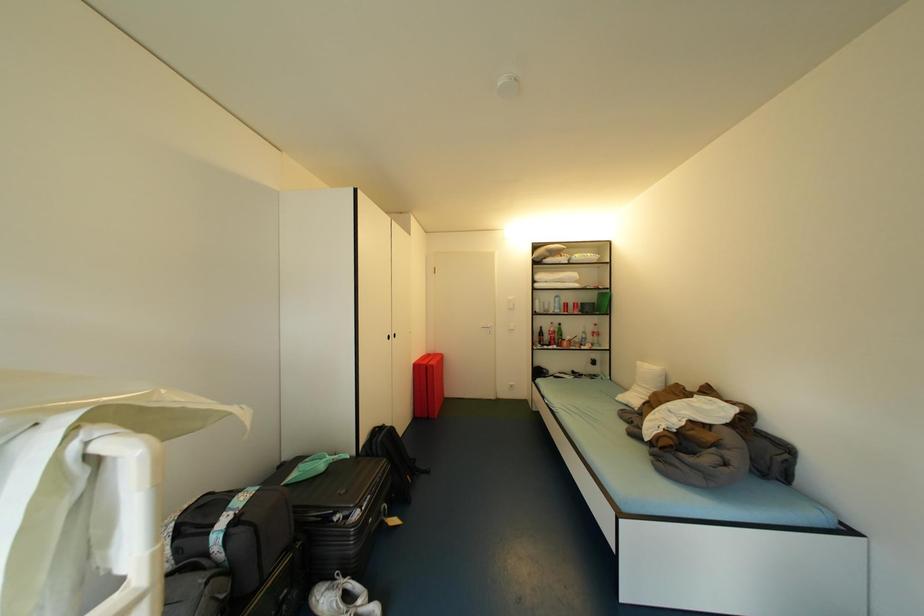
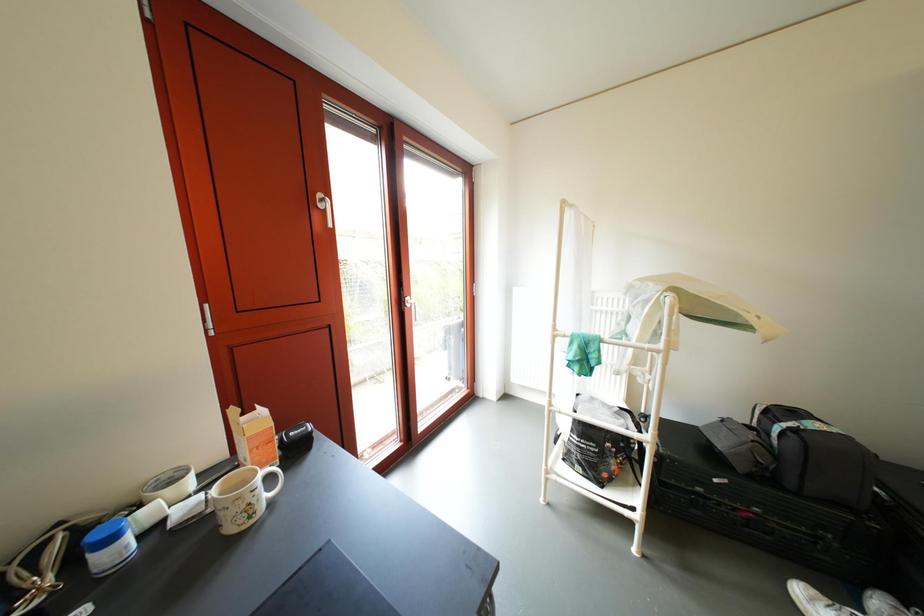
Question: The camera is either moving clockwise (left) or counter-clockwise (right) around the object. The first image is from the beginning of the video and the second image is from the end. Is the camera moving left or right when shooting the video?

Choices:
 (A) Left
 (B) Right

Answer: (B)